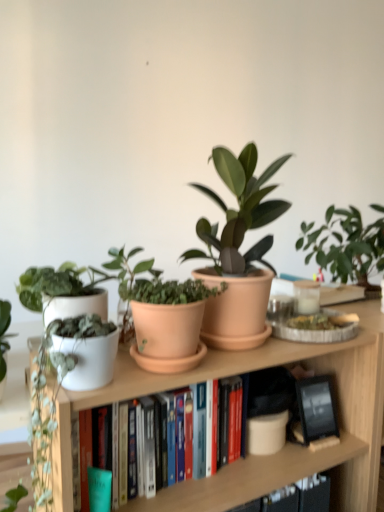
Question: In terms of width, does white matte book at center look wider or thinner when compared to white matte plant pot at left?

Choices:
 (A) thin
 (B) wide

Answer: (A)

Question: Is white matte book at center situated inside white matte plant pot at left or outside?

Choices:
 (A) inside
 (B) outside

Answer: (A)

Question: Based on their relative distances, which object is nearer to the white matte pot at left, marked as the 3th houseplant in a right-to-left arrangement?

Choices:
 (A) white matte plant pot at left
 (B) matte terracotta pot at center, the first houseplant from the right
 (C) terracotta clay pot at center, which is counted as the 2th houseplant, starting from the right
 (D) white matte book at center

Answer: (C)

Question: Which of these objects is positioned farthest from the white matte book at center?

Choices:
 (A) matte terracotta pot at center, acting as the 3th houseplant starting from the left
 (B) white matte plant pot at left
 (C) terracotta clay pot at center, which is counted as the 2th houseplant, starting from the right
 (D) white matte pot at left, which is the first houseplant from left to right

Answer: (A)